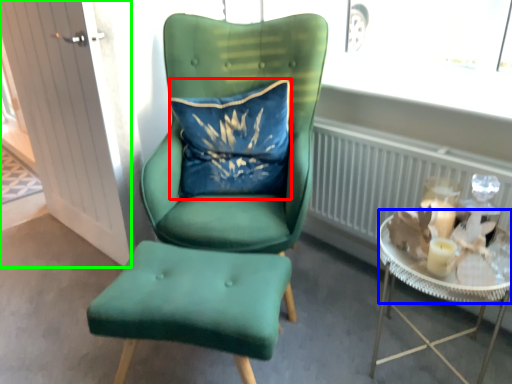
Question: Which object is positioned farthest from pillow (highlighted by a red box)? Select from glass table (highlighted by a blue box) and glass door (highlighted by a green box).

Choices:
 (A) glass table
 (B) glass door

Answer: (A)